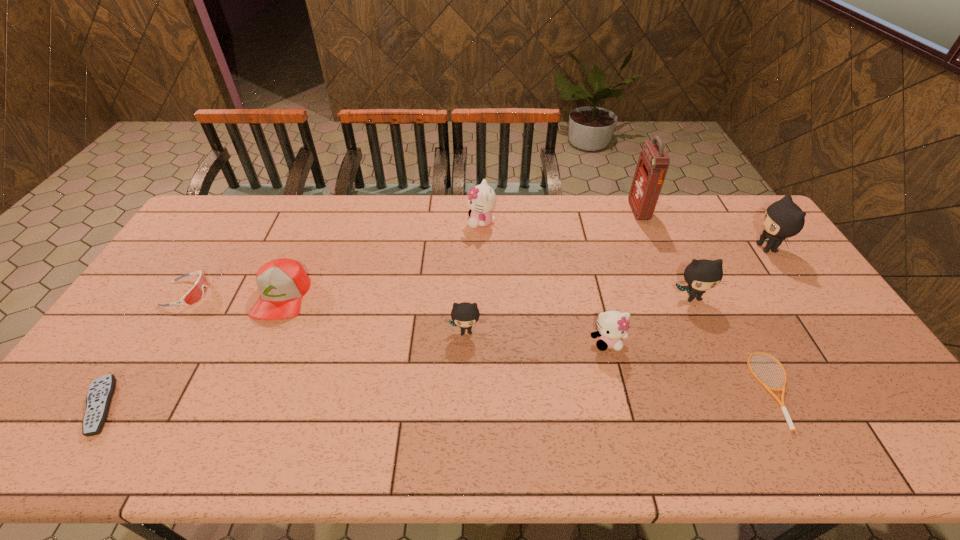
Find the location of `vacant region located 0.050m on the front-facing side of the tallest object`. vacant region located 0.050m on the front-facing side of the tallest object is located at coordinates (618, 211).

This screenshot has width=960, height=540. I want to click on vacant region located 0.230m on the front-facing side of the tallest object, so 569,211.

Locate an element on the screen. free space located 0.300m on the front-facing side of the rightmost object is located at coordinates (662, 248).

You are a GUI agent. You are given a task and a screenshot of the screen. Output one action in this format:
    pyautogui.click(x=<x>, y=<y>)
    Task: Click on the vacant space positioned 0.260m on the front-facing side of the rightmost object
    
    Given the screenshot: What is the action you would take?
    pyautogui.click(x=674, y=248)

What are the coordinates of `vacant space situated 0.190m on the front-facing side of the rightmost object` in the screenshot? It's located at (695, 248).

You are a GUI agent. You are given a task and a screenshot of the screen. Output one action in this format:
    pyautogui.click(x=<x>, y=<y>)
    Task: Click on the vacant space located on the front-facing side of the bigger white kitten
    This screenshot has height=540, width=960.
    Given the screenshot: What is the action you would take?
    pyautogui.click(x=453, y=222)

At what (x,y) coordinates should I click in order to perform the action: click on vacant space located 0.110m on the front-facing side of the bigger white kitten. Please return your answer as a coordinate pair (x, y). This screenshot has height=540, width=960. Looking at the image, I should click on (437, 222).

Find the location of a particular element. This screenshot has height=540, width=960. vacant area situated on the front-facing side of the bigger white kitten is located at coordinates (393, 222).

Identify the location of free location located 0.210m on the front-facing side of the second smallest gray kitten. The image size is (960, 540). (725, 369).

You are a GUI agent. You are given a task and a screenshot of the screen. Output one action in this format:
    pyautogui.click(x=<x>, y=<y>)
    Task: Click on the free space located 0.270m on the front-facing side of the sixth object from left to right
    The width and height of the screenshot is (960, 540).
    Given the screenshot: What is the action you would take?
    pyautogui.click(x=636, y=453)